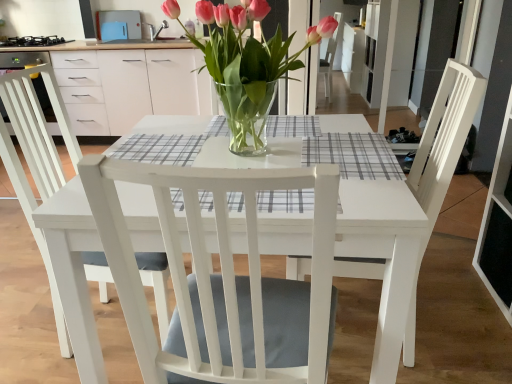
Question: Is black matte stove at upper left at the left side of white wood chair at center, the 1th chair viewed from the left?

Choices:
 (A) no
 (B) yes

Answer: (B)

Question: Is black matte stove at upper left shorter than white wood chair at center, the 1th chair viewed from the left?

Choices:
 (A) yes
 (B) no

Answer: (A)

Question: From a real-world perspective, does black matte stove at upper left sit lower than white wood chair at center, the 1th chair viewed from the left?

Choices:
 (A) yes
 (B) no

Answer: (B)

Question: Does black matte stove at upper left have a larger size compared to white wood chair at center, positioned as the second chair in right-to-left order?

Choices:
 (A) no
 (B) yes

Answer: (A)

Question: Is black matte stove at upper left taller than white wood chair at center, the 1th chair viewed from the left?

Choices:
 (A) no
 (B) yes

Answer: (A)

Question: Relative to clear glass vase at center, is plaid fabric at center, which ranks as the second plaid in top-to-bottom order, in front or behind?

Choices:
 (A) front
 (B) behind

Answer: (A)

Question: Considering the positions of point (270, 195) and point (259, 92), is point (270, 195) closer or farther from the camera than point (259, 92)?

Choices:
 (A) farther
 (B) closer

Answer: (B)

Question: From the image's perspective, is plaid fabric at center, marked as the second plaid in a right-to-left arrangement, positioned above or below clear glass vase at center?

Choices:
 (A) above
 (B) below

Answer: (B)

Question: Is plaid fabric at center, acting as the 2th plaid starting from the back, spatially inside clear glass vase at center, or outside of it?

Choices:
 (A) outside
 (B) inside

Answer: (A)

Question: Considering their positions, is white wood chair at center, the 1th chair viewed from the left, located in front of or behind gray checkered placemat at center, the second plaid viewed from the left?

Choices:
 (A) front
 (B) behind

Answer: (A)

Question: Looking at the image, does white wood chair at center, positioned as the second chair in right-to-left order, seem bigger or smaller compared to gray checkered placemat at center, which is the first plaid in back-to-front order?

Choices:
 (A) small
 (B) big

Answer: (B)

Question: Choose the correct answer: Is white wood chair at center, the 1th chair viewed from the left, inside gray checkered placemat at center, the 1th plaid positioned from the top, or outside it?

Choices:
 (A) inside
 (B) outside

Answer: (B)

Question: From the image's perspective, is white wood chair at center, the 1th chair viewed from the left, above or below gray checkered placemat at center, which is the second plaid from front to back?

Choices:
 (A) below
 (B) above

Answer: (A)

Question: In the image, is gray checkered placemat at center, which is the second plaid from front to back, positioned in front of or behind white wood chair at center, positioned as the second chair in right-to-left order?

Choices:
 (A) front
 (B) behind

Answer: (B)

Question: Based on their sizes in the image, would you say gray checkered placemat at center, marked as the 2th plaid in a bottom-to-top arrangement, is bigger or smaller than white wood chair at center, positioned as the second chair in right-to-left order?

Choices:
 (A) small
 (B) big

Answer: (A)